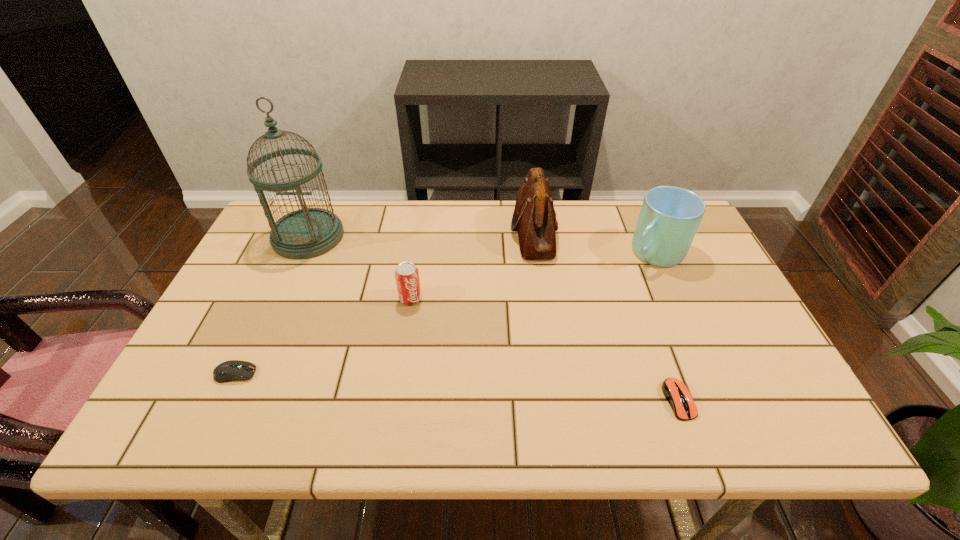
At what (x,y) coordinates should I click in order to perform the action: click on free region located on the right of the shoulder bag. Please return your answer as a coordinate pair (x, y). Image resolution: width=960 pixels, height=540 pixels. Looking at the image, I should click on (651, 232).

This screenshot has width=960, height=540. Identify the location of vacant region located 0.070m on the back of the third tallest object. (640, 221).

Locate an element on the screen. The height and width of the screenshot is (540, 960). vacant space located 0.370m on the back of the fourth tallest object is located at coordinates (424, 210).

This screenshot has height=540, width=960. What are the coordinates of `vacant space located on the button of the left computer mouse` in the screenshot? It's located at (287, 374).

Where is `vacant space located on the left of the shorter computer mouse`? This screenshot has width=960, height=540. vacant space located on the left of the shorter computer mouse is located at coordinates (599, 400).

The width and height of the screenshot is (960, 540). Identify the location of birdcage positioned at the far edge. (308, 232).

You are a GUI agent. You are given a task and a screenshot of the screen. Output one action in this format:
    pyautogui.click(x=<x>, y=<y>)
    Task: Click on the shoulder bag present at the far edge
    
    Given the screenshot: What is the action you would take?
    pyautogui.click(x=534, y=218)

Identify the location of mug located in the far edge section of the desktop. (670, 216).

Where is `object located at the near edge`? Image resolution: width=960 pixels, height=540 pixels. object located at the near edge is located at coordinates (677, 394).

The image size is (960, 540). Find the location of `birdcage that is at the left edge`. birdcage that is at the left edge is located at coordinates (308, 232).